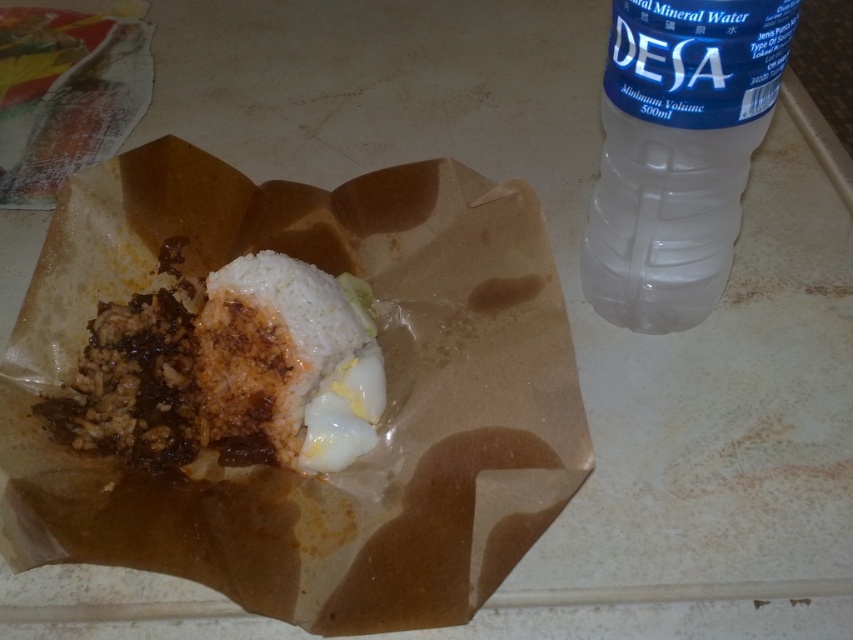
Consider the image. Who is positioned more to the right, transparent plastic bottle at upper right or white matte rice at center?

From the viewer's perspective, transparent plastic bottle at upper right appears more on the right side.

This screenshot has height=640, width=853. I want to click on transparent plastic bottle at upper right, so click(x=677, y=152).